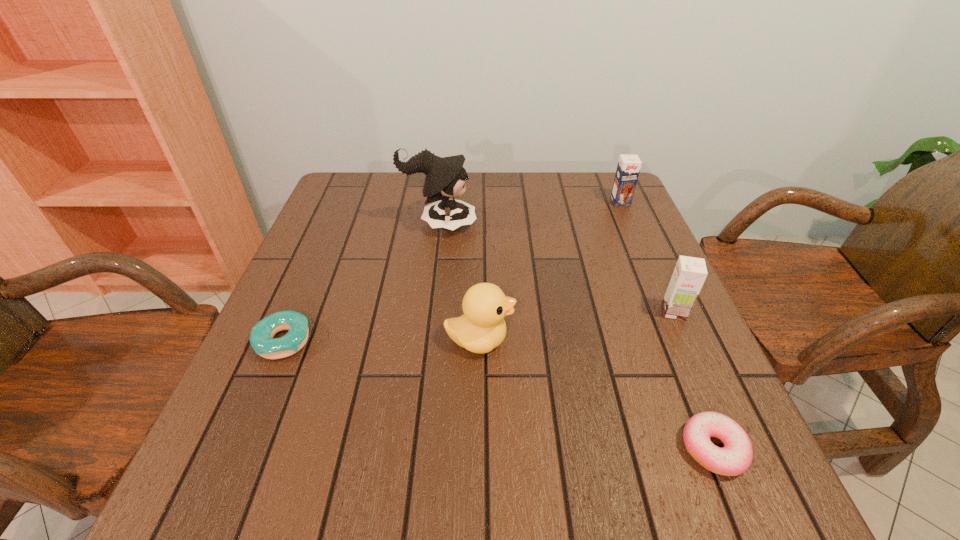
You are a GUI agent. You are given a task and a screenshot of the screen. Output one action in this format:
    pyautogui.click(x=<x>, y=<y>)
    Task: Click on the free space located 0.270m on the front label of the farthest object
    This screenshot has height=540, width=960.
    Given the screenshot: What is the action you would take?
    pyautogui.click(x=650, y=269)

At what (x,y) coordinates should I click in order to perform the action: click on vacant area situated on the front of the nearer chocolate milk. Please return your answer as a coordinate pair (x, y). The image size is (960, 540). Looking at the image, I should click on (694, 356).

Identify the location of vacant area located 0.370m on the face of the duck. The image size is (960, 540). 699,340.

Locate an element on the screen. The height and width of the screenshot is (540, 960). free point located on the back of the left doughnut is located at coordinates [324, 246].

The height and width of the screenshot is (540, 960). I want to click on free location located on the back of the nearest object, so click(x=668, y=338).

Find the location of a particular element. doll that is at the far edge is located at coordinates (445, 179).

This screenshot has width=960, height=540. Find the location of `chocolate milk that is positioned at the far edge`. chocolate milk that is positioned at the far edge is located at coordinates point(628,168).

You are a GUI agent. You are given a task and a screenshot of the screen. Output one action in this format:
    pyautogui.click(x=<x>, y=<y>)
    Task: Click on the object that is positioned at the near edge
    
    Given the screenshot: What is the action you would take?
    pyautogui.click(x=736, y=456)

Where is `object located in the left edge section of the desktop`? object located in the left edge section of the desktop is located at coordinates (261, 339).

Identify the location of doughnut present at the right edge. This screenshot has height=540, width=960. pyautogui.click(x=736, y=456).